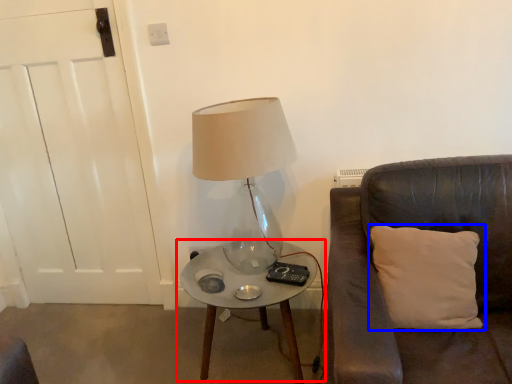
Question: Which object appears closest to the camera in this image, table (highlighted by a red box) or pillow (highlighted by a blue box)?

Choices:
 (A) table
 (B) pillow

Answer: (B)